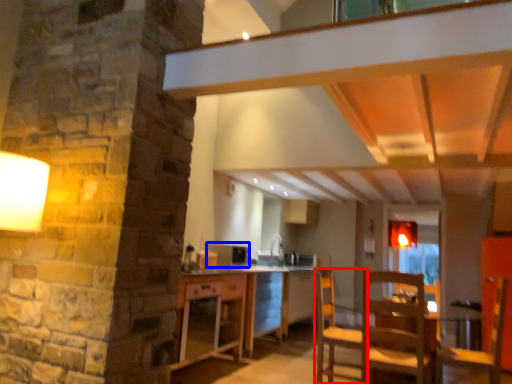
Question: Which object is further to the camera taking this photo, chair (highlighted by a red box) or appliance (highlighted by a blue box)?

Choices:
 (A) chair
 (B) appliance

Answer: (B)